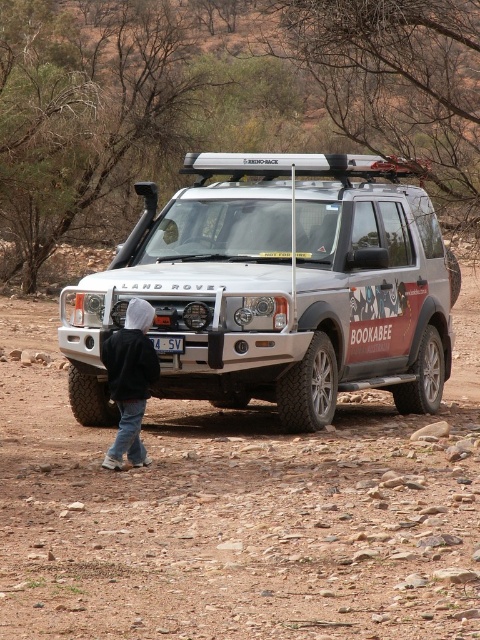
Question: Can you confirm if dirt track at center is bigger than silver metallic jeep at center?

Choices:
 (A) yes
 (B) no

Answer: (A)

Question: Which point appears closest to the camera in this image?

Choices:
 (A) (122, 394)
 (B) (127, 548)
 (C) (263, 355)

Answer: (B)

Question: Which of these objects is positioned farthest from the silver metallic jeep at center?

Choices:
 (A) dirt track at center
 (B) white plastic license plate at center
 (C) black hoodie at lower left

Answer: (A)

Question: Is the position of silver metallic jeep at center less distant than that of black hoodie at lower left?

Choices:
 (A) yes
 (B) no

Answer: (B)

Question: Which point is closer to the camera taking this photo?

Choices:
 (A) (284, 154)
 (B) (127, 433)
 (C) (160, 349)

Answer: (B)

Question: Does black hoodie at lower left appear on the left side of white plastic license plate at center?

Choices:
 (A) yes
 (B) no

Answer: (A)